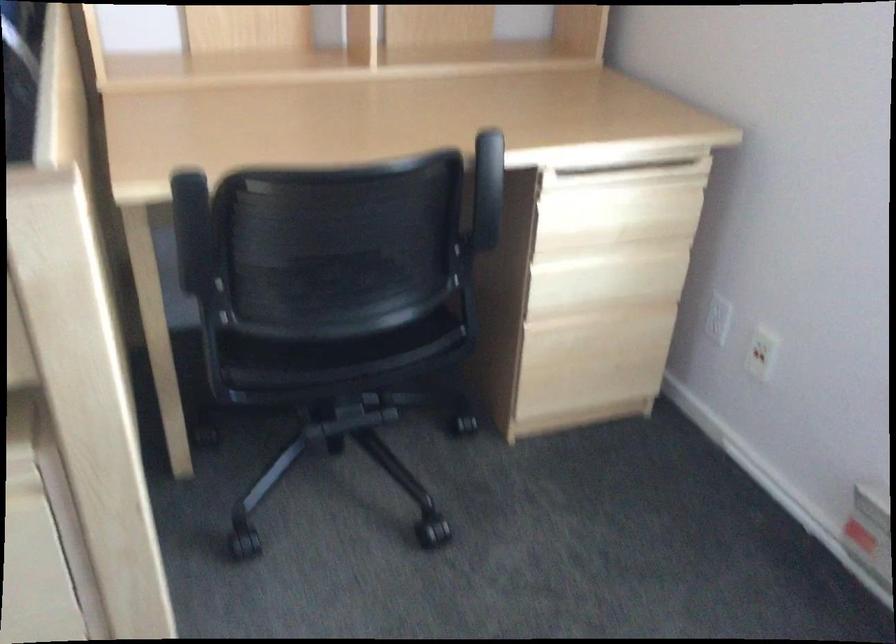
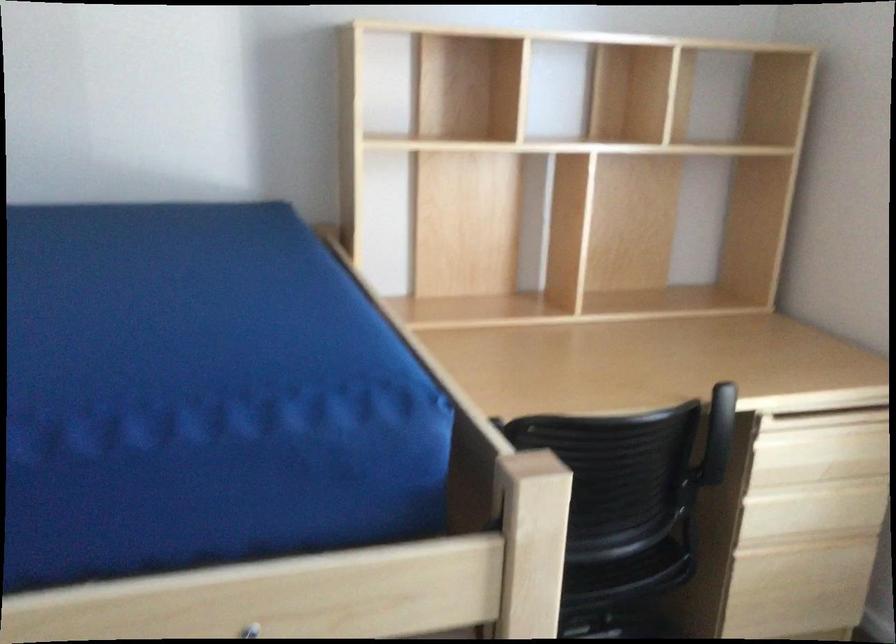
What movement of the cameraman would produce the second image?

The movement direction of the cameraman is left, backward.